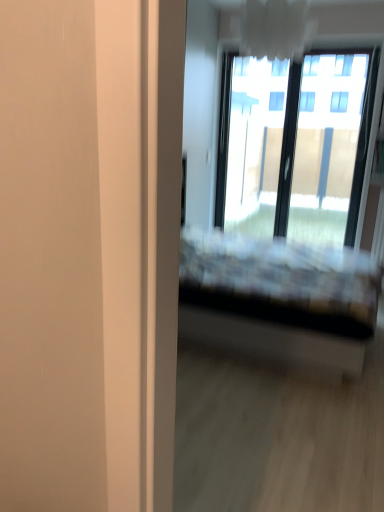
Question: From a real-world perspective, is transparent glass window at upper right above or below plaid fabric bed at center?

Choices:
 (A) below
 (B) above

Answer: (B)

Question: From their relative heights in the image, would you say transparent glass window at upper right is taller or shorter than plaid fabric bed at center?

Choices:
 (A) tall
 (B) short

Answer: (A)

Question: Considering their positions, is transparent glass window at upper right located in front of or behind plaid fabric bed at center?

Choices:
 (A) behind
 (B) front

Answer: (A)

Question: From the image's perspective, is plaid fabric bed at center positioned above or below transparent glass window at upper right?

Choices:
 (A) below
 (B) above

Answer: (A)

Question: In terms of height, does plaid fabric bed at center look taller or shorter compared to transparent glass window at upper right?

Choices:
 (A) short
 (B) tall

Answer: (A)

Question: Considering their positions, is plaid fabric bed at center located in front of or behind transparent glass window at upper right?

Choices:
 (A) behind
 (B) front

Answer: (B)

Question: Is point (258, 290) positioned closer to the camera than point (321, 133)?

Choices:
 (A) farther
 (B) closer

Answer: (B)